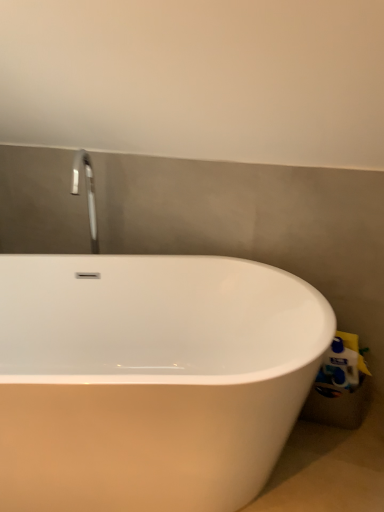
Question: From the image's perspective, does white glossy bathtub at center appear lower than white plastic toilet paper at lower right?

Choices:
 (A) no
 (B) yes

Answer: (B)

Question: Is white glossy bathtub at center not inside white plastic toilet paper at lower right?

Choices:
 (A) yes
 (B) no

Answer: (A)

Question: Would you say white glossy bathtub at center is a long distance from white plastic toilet paper at lower right?

Choices:
 (A) no
 (B) yes

Answer: (A)

Question: Could you tell me if white glossy bathtub at center is turned towards white plastic toilet paper at lower right?

Choices:
 (A) yes
 (B) no

Answer: (B)

Question: Is white glossy bathtub at center directly adjacent to white plastic toilet paper at lower right?

Choices:
 (A) yes
 (B) no

Answer: (B)

Question: Is white glossy bathtub at center behind white plastic toilet paper at lower right?

Choices:
 (A) yes
 (B) no

Answer: (B)

Question: Can we say white plastic toilet paper at lower right lies outside white glossy bathtub at center?

Choices:
 (A) yes
 (B) no

Answer: (A)

Question: From the image's perspective, does white plastic toilet paper at lower right appear higher than white glossy bathtub at center?

Choices:
 (A) yes
 (B) no

Answer: (A)

Question: Can you confirm if white plastic toilet paper at lower right is shorter than white glossy bathtub at center?

Choices:
 (A) no
 (B) yes

Answer: (B)

Question: Can you confirm if white plastic toilet paper at lower right is taller than white glossy bathtub at center?

Choices:
 (A) yes
 (B) no

Answer: (B)

Question: Can you confirm if white plastic toilet paper at lower right is smaller than white glossy bathtub at center?

Choices:
 (A) yes
 (B) no

Answer: (A)

Question: Is white plastic toilet paper at lower right to the left of white glossy bathtub at center from the viewer's perspective?

Choices:
 (A) no
 (B) yes

Answer: (A)

Question: From a real-world perspective, is white plastic toilet paper at lower right above or below white glossy bathtub at center?

Choices:
 (A) above
 (B) below

Answer: (A)